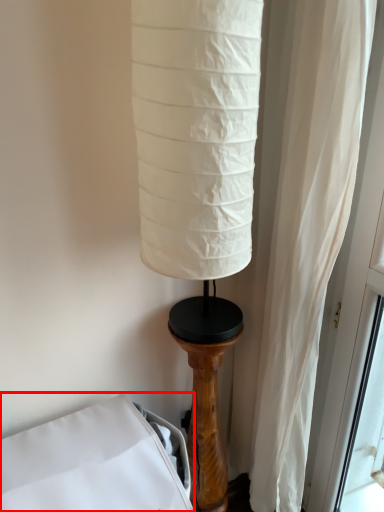
Question: From the image, what is the correct spatial relationship of furniture (annotated by the red box) in relation to pillar?

Choices:
 (A) left
 (B) right

Answer: (A)